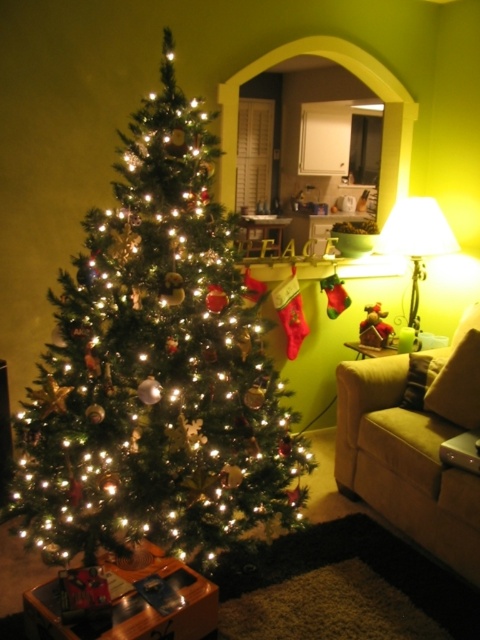
Question: Which point is closer to the camera taking this photo?

Choices:
 (A) (73, 476)
 (B) (423, 198)

Answer: (A)

Question: Which of the following is the farthest from the observer?

Choices:
 (A) white fabric lampshade at right
 (B) suede-like beige couch at lower right

Answer: (A)

Question: Among these points, which one is farthest from the camera?

Choices:
 (A) click(x=454, y=246)
 (B) click(x=84, y=412)
 (C) click(x=384, y=413)

Answer: (A)

Question: Is green matte christmas tree at left to the left of white fabric lampshade at right from the viewer's perspective?

Choices:
 (A) yes
 (B) no

Answer: (A)

Question: Observing the image, what is the correct spatial positioning of green matte christmas tree at left in reference to white fabric lampshade at right?

Choices:
 (A) above
 (B) below

Answer: (B)

Question: Can you confirm if green matte christmas tree at left is positioned below suede-like beige couch at lower right?

Choices:
 (A) yes
 (B) no

Answer: (B)